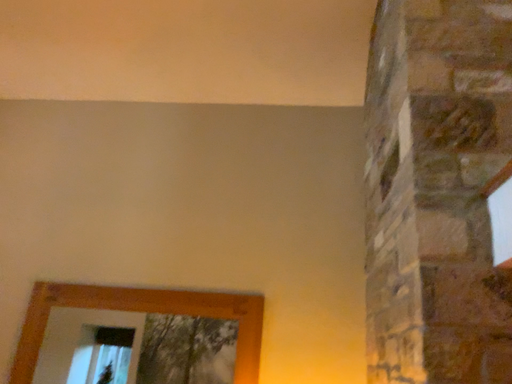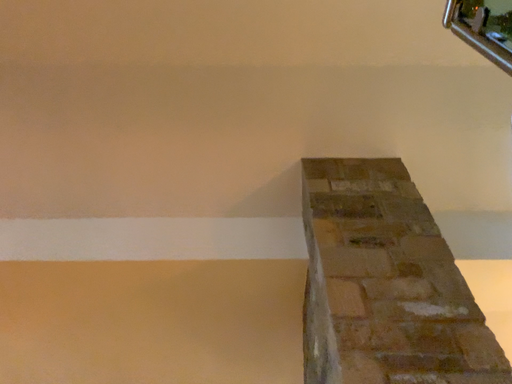
Question: Which way did the camera rotate in the video?

Choices:
 (A) rotated downward
 (B) rotated upward

Answer: (B)